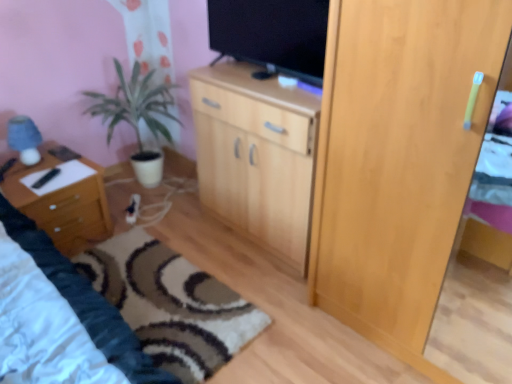
Find the location of a particular element. free space below light wood cupboard at right (from a real-world perspective) is located at coordinates (464, 329).